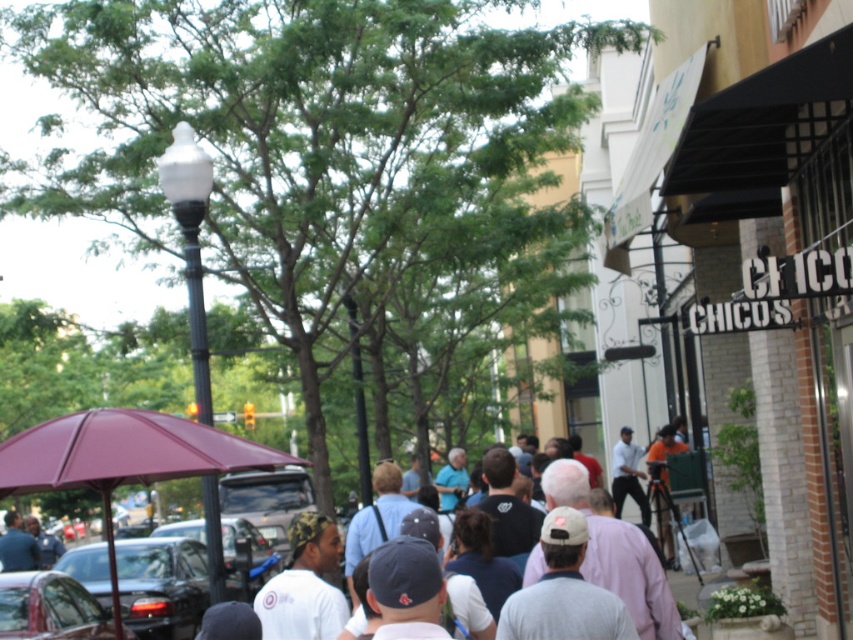
Who is positioned more to the right, maroon fabric umbrella at center or metallic gray car at center?

Positioned to the right is maroon fabric umbrella at center.

Consider the image. Can you confirm if maroon fabric umbrella at center is wider than metallic gray car at center?

Incorrect, maroon fabric umbrella at center's width does not surpass metallic gray car at center's.

Which is in front, point (190, 436) or point (248, 520)?

Positioned in front is point (190, 436).

At what (x,y) coordinates should I click in order to perform the action: click on maroon fabric umbrella at center. Please return your answer as a coordinate pair (x, y). The width and height of the screenshot is (853, 640). Looking at the image, I should click on (123, 458).

Is maroon fabric umbrella at center further to camera compared to white cotton t-shirt at center?

Yes, it is behind white cotton t-shirt at center.

Based on the photo, which is more to the right, maroon fabric umbrella at center or white cotton t-shirt at center?

white cotton t-shirt at center

Where is `maroon fabric umbrella at center`? The width and height of the screenshot is (853, 640). maroon fabric umbrella at center is located at coordinates (123, 458).

This screenshot has height=640, width=853. Describe the element at coordinates (564, 592) in the screenshot. I see `gray cotton cap at center` at that location.

Which is more to the right, gray cotton cap at center or white cotton t-shirt at center?

From the viewer's perspective, white cotton t-shirt at center appears more on the right side.

The height and width of the screenshot is (640, 853). What are the coordinates of `gray cotton cap at center` in the screenshot? It's located at (564, 592).

What are the coordinates of `gray cotton cap at center` in the screenshot? It's located at (564, 592).